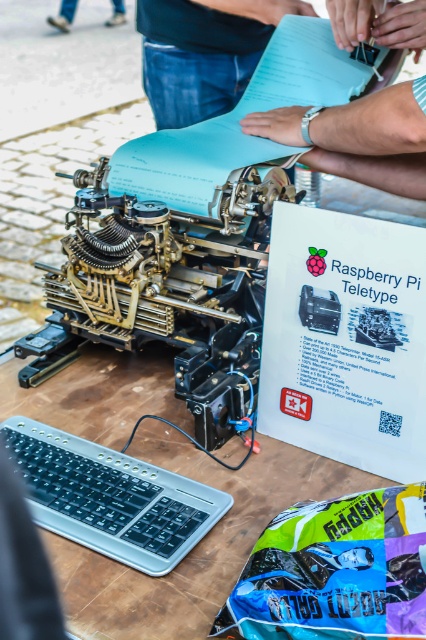
Is point (311, 60) positioned after point (95, 477)?

Yes.

Is brass mechanical typewriter at center wider than silver metallic keyboard at lower left?

Correct, the width of brass mechanical typewriter at center exceeds that of silver metallic keyboard at lower left.

Identify the location of brass mechanical typewriter at center. The width and height of the screenshot is (426, 640). (192, 232).

Locate an element on the screen. brass mechanical typewriter at center is located at coordinates pos(192,232).

Is wooden table at center smaller than silver metallic watch at upper center?

No.

Between wooden table at center and silver metallic watch at upper center, which one has less height?

Standing shorter between the two is silver metallic watch at upper center.

The height and width of the screenshot is (640, 426). I want to click on wooden table at center, so click(x=196, y=545).

Who is shorter, wooden table at center or brown leather shoes at upper left?

With less height is brown leather shoes at upper left.

Who is lower down, wooden table at center or brown leather shoes at upper left?

wooden table at center

The width and height of the screenshot is (426, 640). What do you see at coordinates (196, 545) in the screenshot?
I see `wooden table at center` at bounding box center [196, 545].

At what (x,y) coordinates should I click in order to perform the action: click on wooden table at center. Please return your answer as a coordinate pair (x, y). This screenshot has height=640, width=426. Looking at the image, I should click on (196, 545).